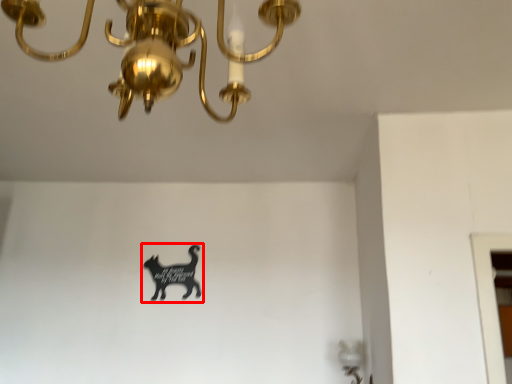
Question: Where is animal (annotated by the red box) located in relation to lamp in the image?

Choices:
 (A) left
 (B) right

Answer: (A)